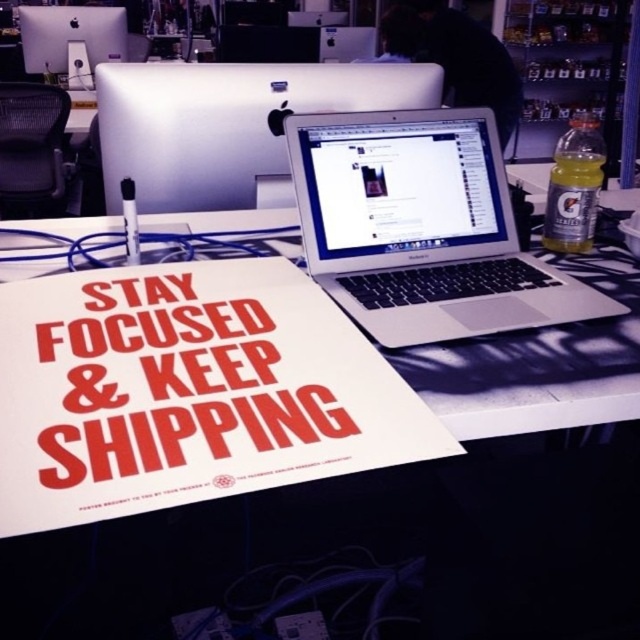
Who is lower down, red matte poster at center or sleek silver monitor at upper center?

red matte poster at center

Can you confirm if red matte poster at center is taller than sleek silver monitor at upper center?

Incorrect, red matte poster at center's height is not larger of sleek silver monitor at upper center's.

Find the location of `red matte poster at center`. red matte poster at center is located at coordinates (186, 385).

This screenshot has width=640, height=640. Identify the location of red matte poster at center. (186, 385).

Who is shorter, red matte poster at center or black mesh chair at upper left?

Standing shorter between the two is red matte poster at center.

Measure the distance from red matte poster at center to black mesh chair at upper left.

red matte poster at center and black mesh chair at upper left are 2.59 meters apart.

Does point (61, 454) lie behind point (51, 125)?

No, (61, 454) is in front of (51, 125).

You are a GUI agent. You are given a task and a screenshot of the screen. Output one action in this format:
    pyautogui.click(x=<x>, y=<y>)
    Task: Click on the red matte poster at center
    Image resolution: width=640 pixels, height=640 pixels.
    Given the screenshot: What is the action you would take?
    pyautogui.click(x=186, y=385)

Which of these two, white plastic desk at center or matte black monitor at upper left, stands shorter?

With less height is white plastic desk at center.

Does white plastic desk at center appear under matte black monitor at upper left?

Yes, white plastic desk at center is below matte black monitor at upper left.

Is point (449, 342) closer to camera compared to point (92, 36)?

Yes, it is in front of point (92, 36).

At what (x,y) coordinates should I click in order to perform the action: click on white plastic desk at center. Please return your answer as a coordinate pair (x, y). The width and height of the screenshot is (640, 640). Looking at the image, I should click on (369, 545).